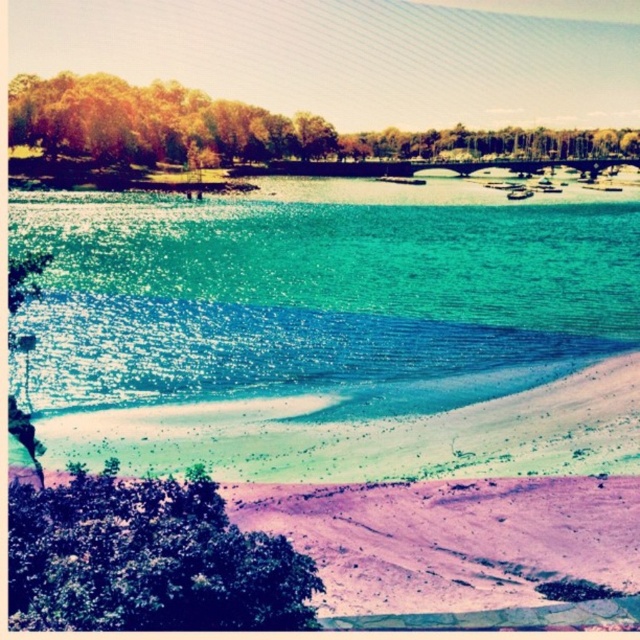
Is green leafy tree at lower left behind green leafy trees at upper center?

No, green leafy tree at lower left is in front of green leafy trees at upper center.

Does green leafy tree at lower left appear on the left side of green leafy trees at upper center?

Indeed, green leafy tree at lower left is positioned on the left side of green leafy trees at upper center.

Who is more distant from viewer, (120,525) or (164,96)?

The point (164,96) is more distant.

Locate an element on the screen. green leafy tree at lower left is located at coordinates (147, 560).

Does green leafy trees at upper center have a smaller size compared to green leafy tree at upper center?

No.

Between green leafy trees at upper center and green leafy tree at upper center, which one has more height?

With more height is green leafy trees at upper center.

At what (x,y) coordinates should I click in order to perform the action: click on green leafy trees at upper center. Please return your answer as a coordinate pair (x, y). The image size is (640, 640). Looking at the image, I should click on (252, 129).

From the picture: Can you confirm if translucent teal water at center is bigger than green leafy tree at lower left?

Indeed, translucent teal water at center has a larger size compared to green leafy tree at lower left.

Is point (58, 244) less distant than point (148, 604)?

No, (58, 244) is further to viewer.

Which is in front, point (172, 294) or point (177, 556)?

Point (177, 556) is in front.

Where is `translucent teal water at center`? translucent teal water at center is located at coordinates (321, 298).